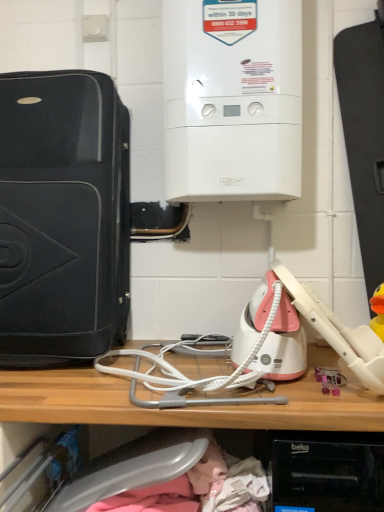
What is the approximate width of white glossy boiler at upper center, the 2th home appliance from the left?

10.93 inches.

Identify the location of wooden shelf at center. (184, 408).

Can you confirm if matte black suitcase at left, positioned as the 1th home appliance in left-to-right order, is shorter than white textured wire at center, the first wire positioned from the top?

No.

Visually, is matte black suitcase at left, positioned as the 1th home appliance in left-to-right order, positioned to the left or to the right of white textured wire at center, the first wire positioned from the top?

Clearly, matte black suitcase at left, positioned as the 1th home appliance in left-to-right order, is on the left of white textured wire at center, the first wire positioned from the top, in the image.

From a real-world perspective, is matte black suitcase at left, positioned as the 1th home appliance in left-to-right order, positioned under white textured wire at center, the first wire positioned from the top, based on gravity?

Incorrect, from a real-world perspective, matte black suitcase at left, positioned as the 1th home appliance in left-to-right order, is higher than white textured wire at center, the first wire positioned from the top.

Is matte black suitcase at left, placed as the 2th home appliance when sorted from right to left, positioned beyond the bounds of white textured wire at center, which is counted as the 2th wire, starting from the bottom?

Absolutely, matte black suitcase at left, placed as the 2th home appliance when sorted from right to left, is external to white textured wire at center, which is counted as the 2th wire, starting from the bottom.

Based on the photo, is wooden shelf at center spatially inside white textured wire at center, the second wire positioned from the top, or outside of it?

wooden shelf at center exists outside the volume of white textured wire at center, the second wire positioned from the top.

Which is in front, wooden shelf at center or white textured wire at center, positioned as the 1th wire in bottom-to-top order?

wooden shelf at center is more forward.

Between wooden shelf at center and white textured wire at center, positioned as the 1th wire in bottom-to-top order, which one appears on the left side from the viewer's perspective?

From the viewer's perspective, wooden shelf at center appears more on the left side.

From the image's perspective, which one is positioned lower, wooden shelf at center or white textured wire at center, positioned as the 1th wire in bottom-to-top order?

wooden shelf at center is shown below in the image.

Would you consider white textured wire at center, which is counted as the 2th wire, starting from the bottom, to be distant from wooden shelf at center?

No.

From the image's perspective, count 2nd wires upward from the wooden shelf at center and point to it. Please provide its 2D coordinates.

[(190, 379)]

Is white textured wire at center, which is counted as the 2th wire, starting from the bottom, taller than wooden shelf at center?

No.

Is wooden shelf at center at the left side of white glossy boiler at upper center, the 2th home appliance from the left?

Yes.

Is wooden shelf at center shorter than white glossy boiler at upper center, the 2th home appliance from the left?

Yes, wooden shelf at center is shorter than white glossy boiler at upper center, the 2th home appliance from the left.

Is wooden shelf at center positioned behind white glossy boiler at upper center, the 2th home appliance from the left?

No, wooden shelf at center is closer to the viewer.

In terms of width, does white textured wire at center, positioned as the 1th wire in bottom-to-top order, look wider or thinner when compared to white glossy boiler at upper center, the 2th home appliance from the left?

Considering their sizes, white textured wire at center, positioned as the 1th wire in bottom-to-top order, looks broader than white glossy boiler at upper center, the 2th home appliance from the left.

From the image's perspective, would you say white textured wire at center, positioned as the 1th wire in bottom-to-top order, is shown under white glossy boiler at upper center, the 2th home appliance from the left?

Result: Indeed, from the image's perspective, white textured wire at center, positioned as the 1th wire in bottom-to-top order, is shown beneath white glossy boiler at upper center, the 2th home appliance from the left.

Is white textured wire at center, positioned as the 1th wire in bottom-to-top order, positioned far away from white glossy boiler at upper center, the 2th home appliance from the left?

That's not correct — white textured wire at center, positioned as the 1th wire in bottom-to-top order, is a little close to white glossy boiler at upper center, the 2th home appliance from the left.

Between white textured wire at center, the second wire positioned from the top, and white glossy boiler at upper center, the 2th home appliance from the left, which one has larger size?

Bigger between the two is white glossy boiler at upper center, the 2th home appliance from the left.

Is white textured wire at center, positioned as the 1th wire in bottom-to-top order, looking in the opposite direction of white textured wire at center, which is counted as the 2th wire, starting from the bottom?

Yes, white textured wire at center, positioned as the 1th wire in bottom-to-top order,'s orientation is away from white textured wire at center, which is counted as the 2th wire, starting from the bottom.

Considering the sizes of objects white textured wire at center, the second wire positioned from the top, and white textured wire at center, which is counted as the 2th wire, starting from the bottom, in the image provided, who is bigger, white textured wire at center, the second wire positioned from the top, or white textured wire at center, which is counted as the 2th wire, starting from the bottom,?

white textured wire at center, which is counted as the 2th wire, starting from the bottom, is bigger.

Considering the points (129, 354) and (153, 371), which point is in front, point (129, 354) or point (153, 371)?

The point (153, 371) is more forward.

From a real-world perspective, is white textured wire at center, positioned as the 1th wire in bottom-to-top order, physically located above or below white textured wire at center, the first wire positioned from the top?

Clearly, from a real-world perspective, white textured wire at center, positioned as the 1th wire in bottom-to-top order, is below white textured wire at center, the first wire positioned from the top.

Does white textured wire at center, the second wire positioned from the top, have a lesser width compared to matte black suitcase at left, positioned as the 1th home appliance in left-to-right order?

No, white textured wire at center, the second wire positioned from the top, is not thinner than matte black suitcase at left, positioned as the 1th home appliance in left-to-right order.

Can you confirm if white textured wire at center, positioned as the 1th wire in bottom-to-top order, is shorter than matte black suitcase at left, positioned as the 1th home appliance in left-to-right order?

Yes, white textured wire at center, positioned as the 1th wire in bottom-to-top order, is shorter than matte black suitcase at left, positioned as the 1th home appliance in left-to-right order.

I want to click on home appliance to the left of white textured wire at center, the second wire positioned from the top, so click(x=63, y=218).

Between white textured wire at center, the second wire positioned from the top, and matte black suitcase at left, positioned as the 1th home appliance in left-to-right order, which one appears on the left side from the viewer's perspective?

matte black suitcase at left, positioned as the 1th home appliance in left-to-right order, is more to the left.

This screenshot has width=384, height=512. What are the coordinates of `home appliance on the left side of white textured wire at center, which is counted as the 2th wire, starting from the bottom` in the screenshot? It's located at (63, 218).

What are the coordinates of `shelf in front of the white textured wire at center, positioned as the 1th wire in bottom-to-top order` in the screenshot? It's located at (184, 408).

Estimate the real-world distances between objects in this image. Which object is further from wooden shelf at center, pink plastic toy at lower right or white textured wire at center, the first wire positioned from the top?

Based on the image, pink plastic toy at lower right appears to be further to wooden shelf at center.

Considering their positions, is wooden shelf at center positioned further to pink plastic toy at lower right than matte black suitcase at left, positioned as the 1th home appliance in left-to-right order?

matte black suitcase at left, positioned as the 1th home appliance in left-to-right order, is positioned further to the anchor pink plastic toy at lower right.

Estimate the real-world distances between objects in this image. Which object is closer to white textured wire at center, the second wire positioned from the top, white glossy boiler at upper center, the 2th home appliance from the left, or pink plastic toy at lower right?

pink plastic toy at lower right is positioned closer to the anchor white textured wire at center, the second wire positioned from the top.

Consider the image. When comparing their distances from white textured wire at center, positioned as the 1th wire in bottom-to-top order, does white textured wire at center, the first wire positioned from the top, or white glossy boiler at upper center, which is counted as the first home appliance, starting from the right, seem closer?

white textured wire at center, the first wire positioned from the top, lies closer to white textured wire at center, positioned as the 1th wire in bottom-to-top order, than the other object.

When comparing their distances from wooden shelf at center, does white glossy boiler at upper center, the 2th home appliance from the left, or white textured wire at center, the first wire positioned from the top, seem closer?

Based on the image, white textured wire at center, the first wire positioned from the top, appears to be nearer to wooden shelf at center.

When comparing their distances from wooden shelf at center, does white glossy boiler at upper center, which is counted as the first home appliance, starting from the right, or matte black suitcase at left, placed as the 2th home appliance when sorted from right to left, seem further?

white glossy boiler at upper center, which is counted as the first home appliance, starting from the right, is positioned further to the anchor wooden shelf at center.

Which object lies nearer to the anchor point wooden shelf at center, white textured wire at center, the second wire positioned from the top, or white textured wire at center, which is counted as the 2th wire, starting from the bottom?

Among the two, white textured wire at center, which is counted as the 2th wire, starting from the bottom, is located nearer to wooden shelf at center.

From the image, which object appears to be nearer to white textured wire at center, positioned as the 1th wire in bottom-to-top order, white glossy boiler at upper center, the 2th home appliance from the left, or white textured wire at center, the first wire positioned from the top?

white textured wire at center, the first wire positioned from the top, is positioned closer to the anchor white textured wire at center, positioned as the 1th wire in bottom-to-top order.

Find the location of `wire between white glossy boiler at upper center, which is counted as the first home appliance, starting from the right, and pink plastic toy at lower right from top to bottom`. wire between white glossy boiler at upper center, which is counted as the first home appliance, starting from the right, and pink plastic toy at lower right from top to bottom is located at coordinates (190, 379).

Where is `wire that lies between white textured wire at center, which is counted as the 2th wire, starting from the bottom, and wooden shelf at center from top to bottom`? wire that lies between white textured wire at center, which is counted as the 2th wire, starting from the bottom, and wooden shelf at center from top to bottom is located at coordinates (180, 372).

Locate an element on the screen. home appliance between white glossy boiler at upper center, which is counted as the first home appliance, starting from the right, and pink plastic toy at lower right vertically is located at coordinates (x=63, y=218).

Image resolution: width=384 pixels, height=512 pixels. Identify the location of toy that lies between white textured wire at center, which is counted as the 2th wire, starting from the bottom, and wooden shelf at center from top to bottom. click(330, 380).